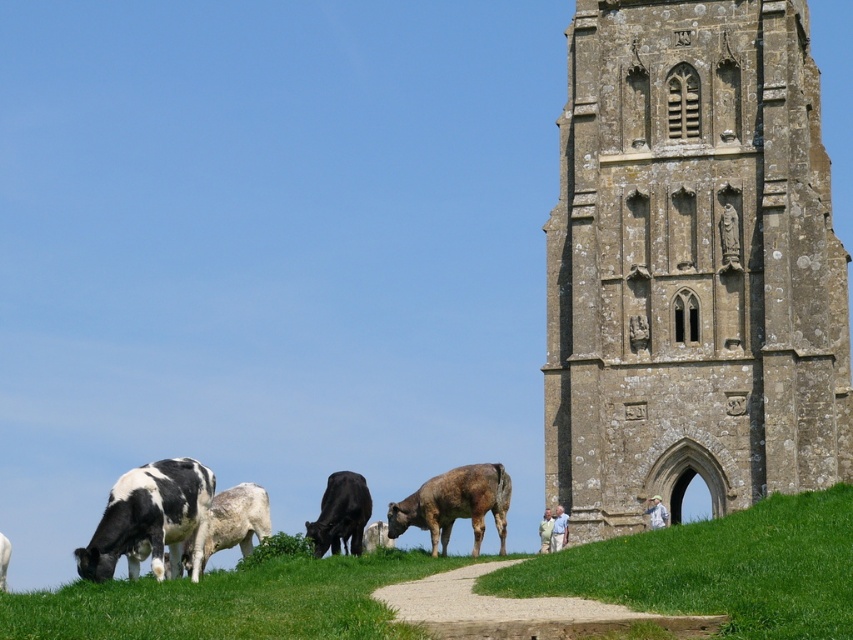
You are a farmer who wants to check on the white and black cow at lower left. Since you are standing on the green grassy at lower left, can you step onto the cow to reach it?

The green grassy at lower left is positioned under the white and black cow at lower left, so you can step onto the grassy area to reach the cow.